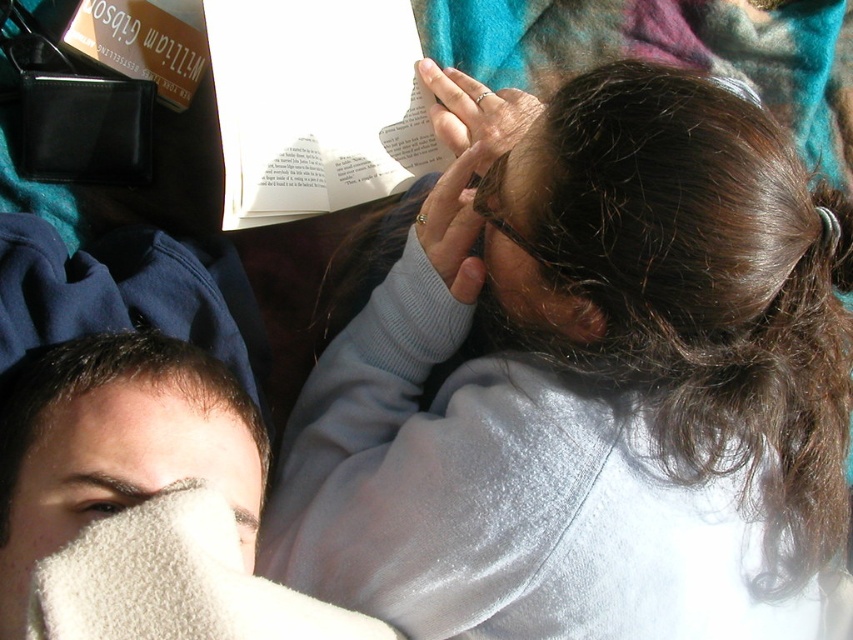
You are standing in the park and want to take a photo of the two people. The camera you have can only focus on objects within 1 meter. Is the point at coordinates point [457,108] within the focus range of your camera?

The point at coordinates point [457,108] is 93.03 centimeters away from the camera, which is within the 1 meter focus range. Therefore, the camera can focus on that point.

You are a photographer who wants to capture a closeup shot of the matte silver ring at upper center and the dry skin at upper left. Based on their positions, which object should you focus on first to ensure both are in focus without moving the camera?

The dry skin at upper left is behind the matte silver ring at upper center, so you should focus on the matte silver ring at upper center first to ensure both are in focus without moving the camera.